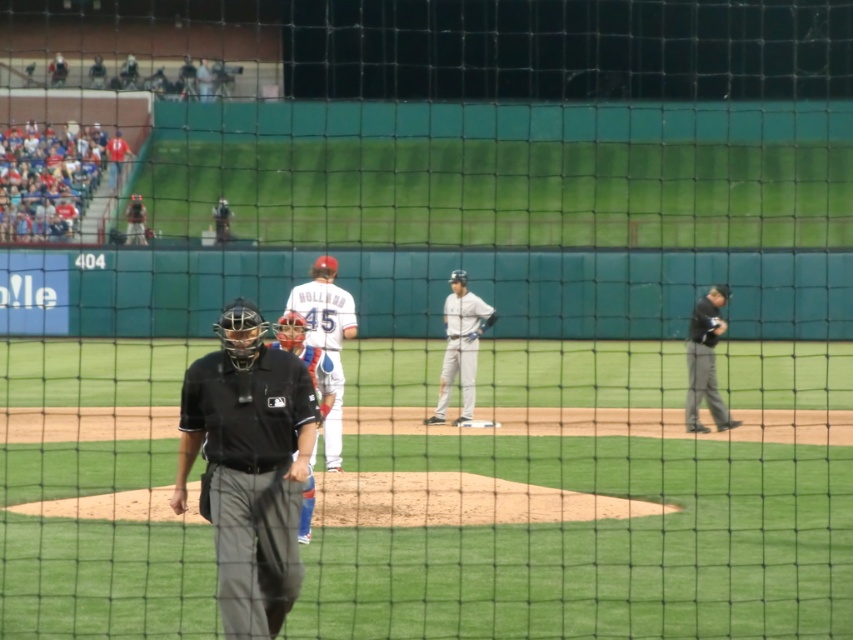
Describe the element at coordinates (115, 157) in the screenshot. I see `matte red shirt at upper left` at that location.

Does matte red shirt at upper left have a greater width compared to white jersey at upper left?

Correct, the width of matte red shirt at upper left exceeds that of white jersey at upper left.

Between point (115, 180) and point (62, 80), which one is positioned behind?

Positioned behind is point (62, 80).

Image resolution: width=853 pixels, height=640 pixels. Identify the location of matte red shirt at upper left. (115, 157).

Identify the location of matte white jersey at upper left. (57, 180).

Which of these two, dark gray uniform at right or gray uniformed man at upper left, stands shorter?

dark gray uniform at right is shorter.

Is point (701, 428) closer to viewer compared to point (184, 81)?

Yes.

Where is `dark gray uniform at right`? This screenshot has height=640, width=853. dark gray uniform at right is located at coordinates (705, 360).